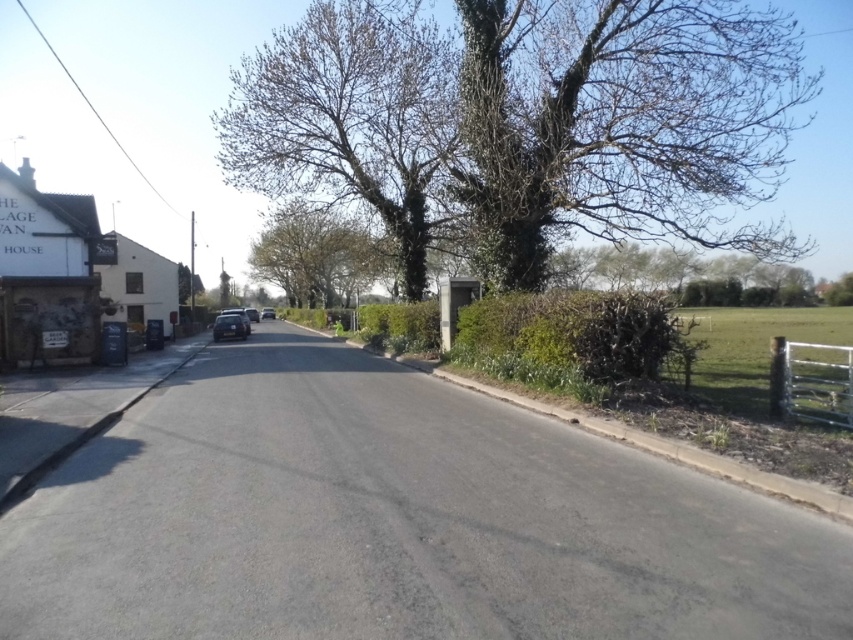
Question: Does green leafy tree at center come in front of shiny silver car at center?

Choices:
 (A) no
 (B) yes

Answer: (B)

Question: Among these objects, which one is nearest to the camera?

Choices:
 (A) metallic silver car at center
 (B) green leafy tree at center

Answer: (B)

Question: Which point appears farthest from the camera in this image?

Choices:
 (A) [231, 321]
 (B) [341, 148]
 (C) [271, 312]

Answer: (C)

Question: Which object is farther from the camera taking this photo?

Choices:
 (A) bare branches at upper center
 (B) green leafy tree at upper center
 (C) shiny silver car at center

Answer: (C)

Question: Is green leafy tree at upper center thinner than bare branches at upper center?

Choices:
 (A) yes
 (B) no

Answer: (B)

Question: Is shiny silver car at center in front of metallic silver car at center?

Choices:
 (A) no
 (B) yes

Answer: (B)